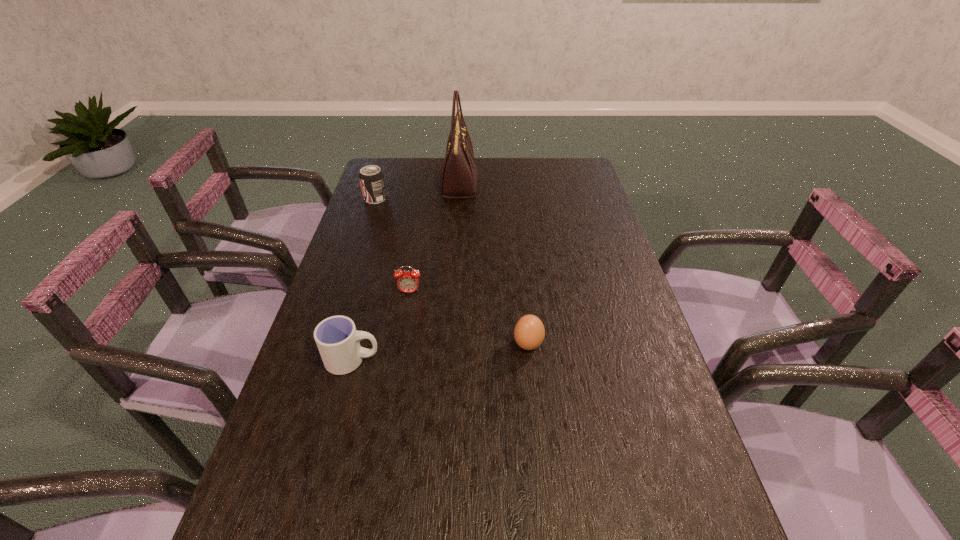
In order to click on free point between the soda can and the cup in this screenshot , I will do `click(364, 279)`.

Locate an element on the screen. Image resolution: width=960 pixels, height=540 pixels. free space between the boiled egg and the cup is located at coordinates (441, 352).

I want to click on vacant space that's between the third object from left to right and the fifth object from left to right, so click(468, 319).

Image resolution: width=960 pixels, height=540 pixels. I want to click on unoccupied area between the handbag and the fifth object from left to right, so click(493, 264).

Locate an element on the screen. The height and width of the screenshot is (540, 960). empty space that is in between the third object from left to right and the tallest object is located at coordinates (434, 238).

At what (x,y) coordinates should I click in order to perform the action: click on free space between the fourth object from right to left and the soda can. Please return your answer as a coordinate pair (x, y). The width and height of the screenshot is (960, 540). Looking at the image, I should click on (393, 245).

Identify which object is the fourth closest to the soda can. Please provide its 2D coordinates. Your answer should be formatted as a tuple, i.e. [(x, y)], where the tuple contains the x and y coordinates of a point satisfying the conditions above.

[(529, 332)]

Point out which object is positioned as the second nearest to the alarm clock. Please provide its 2D coordinates. Your answer should be formatted as a tuple, i.e. [(x, y)], where the tuple contains the x and y coordinates of a point satisfying the conditions above.

[(529, 332)]

You are a GUI agent. You are given a task and a screenshot of the screen. Output one action in this format:
    pyautogui.click(x=<x>, y=<y>)
    Task: Click on the free location that satisfies the following two spatial constraints: 1. on the front side of the fifth object from left to right; 2. with the handle on the side of the cup
    This screenshot has height=540, width=960.
    Given the screenshot: What is the action you would take?
    pyautogui.click(x=530, y=360)

Find the location of a particular element. free space that satisfies the following two spatial constraints: 1. on the front-facing side of the handbag; 2. on the face of the fourth object from right to left is located at coordinates (451, 292).